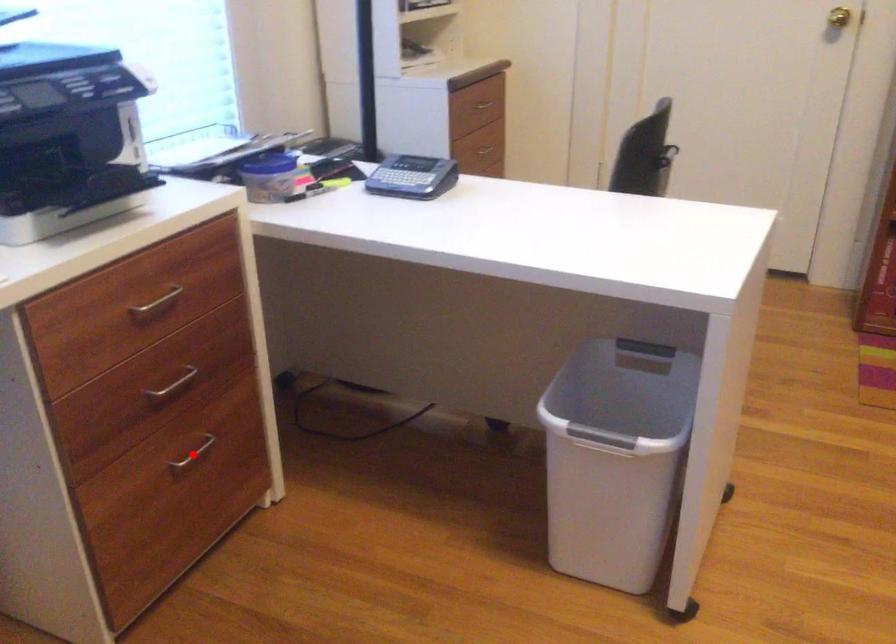
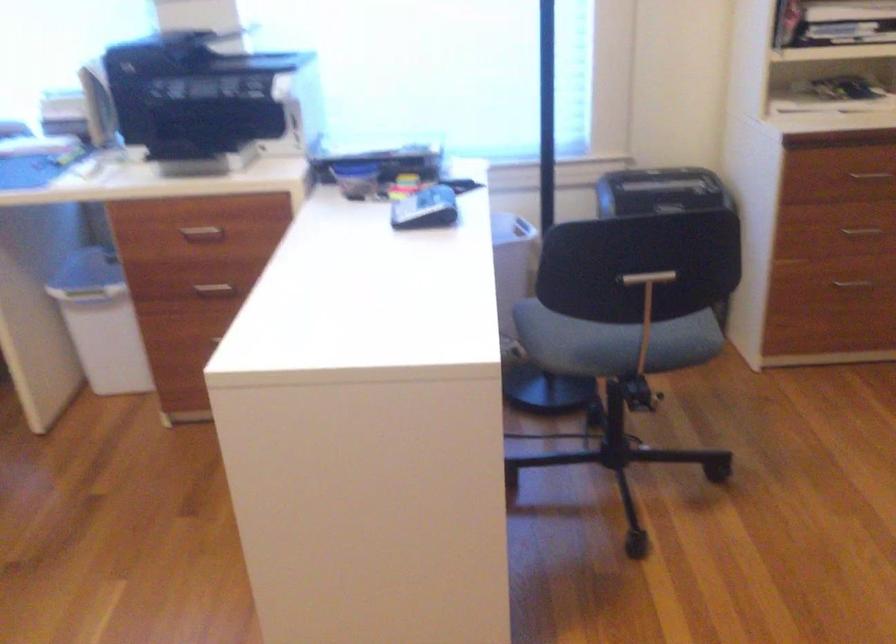
Question: I am providing you with two images of the same scene from different viewpoints. A red point is marked on the first image. At the location where the point appears in image 1, is it still visible in image 2?

Choices:
 (A) Yes
 (B) No

Answer: (B)